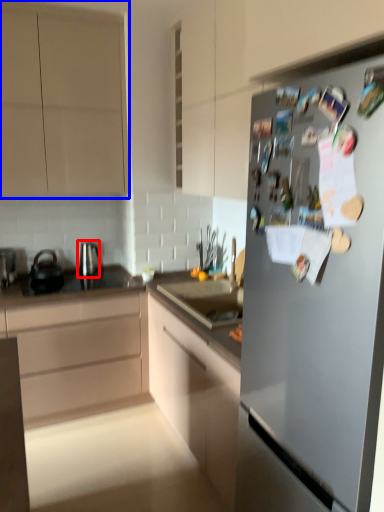
Question: Which object is closer to the camera taking this photo, tea pot (highlighted by a red box) or cabinetry (highlighted by a blue box)?

Choices:
 (A) tea pot
 (B) cabinetry

Answer: (B)